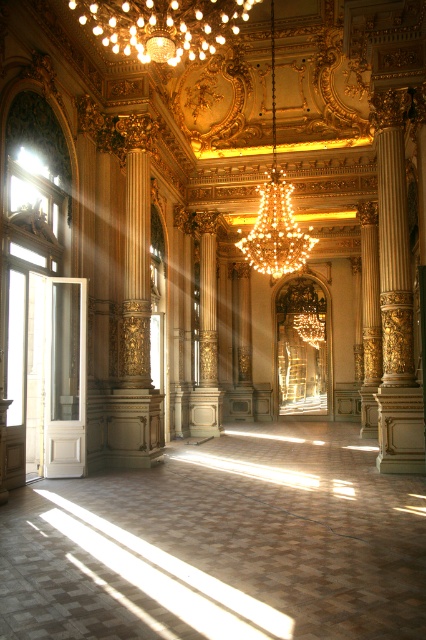
Question: Among these objects, which one is nearest to the camera?

Choices:
 (A) gold crystal chandelier at upper center
 (B) smooth cream-colored column at center
 (C) gold crystal chandelier at center

Answer: (A)

Question: Is the position of gold crystal chandelier at upper center less distant than that of smooth cream-colored column at center?

Choices:
 (A) no
 (B) yes

Answer: (B)

Question: Is gold crystal chandelier at center bigger than smooth cream-colored column at center?

Choices:
 (A) no
 (B) yes

Answer: (B)

Question: Among these objects, which one is nearest to the camera?

Choices:
 (A) gold crystal chandelier at upper center
 (B) smooth cream-colored column at center
 (C) gold crystal chandelier at center

Answer: (A)

Question: Among these objects, which one is nearest to the camera?

Choices:
 (A) gold crystal chandelier at center
 (B) gold crystal chandelier at upper center

Answer: (B)

Question: Is gold crystal chandelier at center thinner than smooth cream-colored column at center?

Choices:
 (A) yes
 (B) no

Answer: (B)